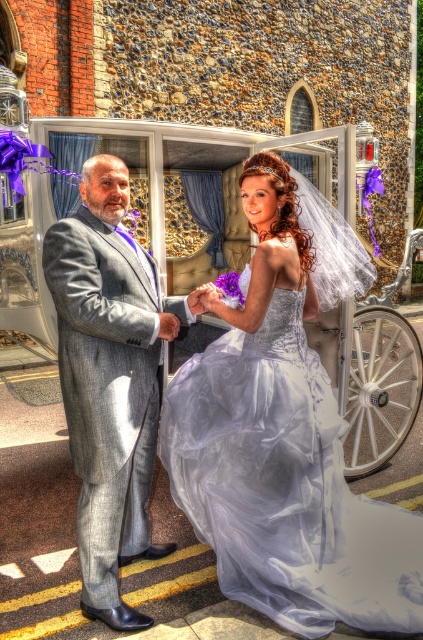
Question: Which of these objects is positioned farthest from the silvery tulle dress at center?

Choices:
 (A) gray wool suit at center
 (B) white wood cart at center

Answer: (B)

Question: Can you confirm if silvery tulle dress at center is positioned above white wood cart at center?

Choices:
 (A) no
 (B) yes

Answer: (A)

Question: Which point appears closest to the camera in this image?

Choices:
 (A) [228, 225]
 (B) [93, 355]

Answer: (B)

Question: Which point appears closest to the camera in this image?

Choices:
 (A) (318, 508)
 (B) (41, 136)
 (C) (159, 372)

Answer: (A)

Question: Is white wood cart at center further to camera compared to gray wool suit at center?

Choices:
 (A) yes
 (B) no

Answer: (A)

Question: Is white wood cart at center to the left of gray wool suit at center from the viewer's perspective?

Choices:
 (A) yes
 (B) no

Answer: (B)